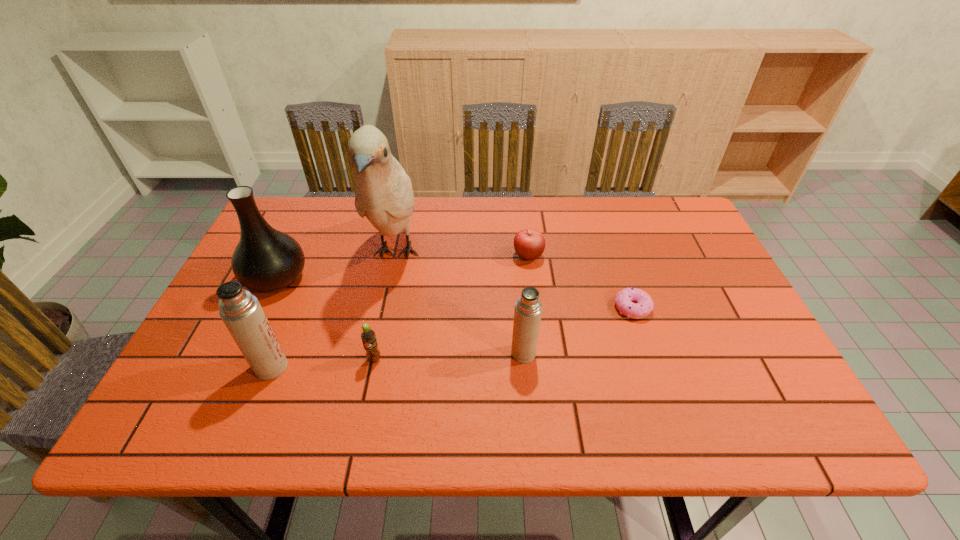
At what (x,y) coordinates should I click in order to perform the action: click on the taller thermos bottle. Please return your answer as a coordinate pair (x, y). The image size is (960, 540). Looking at the image, I should click on (241, 312).

Find the location of a particular element. the shorter thermos bottle is located at coordinates (528, 309).

You are a GUI agent. You are given a task and a screenshot of the screen. Output one action in this format:
    pyautogui.click(x=<x>, y=<y>)
    Task: Click on the right thermos bottle
    The height and width of the screenshot is (540, 960).
    Given the screenshot: What is the action you would take?
    pyautogui.click(x=528, y=309)

At what (x,y) coordinates should I click in order to perform the action: click on the tallest object. Please return your answer as a coordinate pair (x, y). This screenshot has width=960, height=540. Looking at the image, I should click on (383, 193).

I want to click on apple, so pyautogui.click(x=529, y=244).

This screenshot has width=960, height=540. I want to click on vase, so click(x=265, y=260).

Where is `the rightmost object`? Image resolution: width=960 pixels, height=540 pixels. the rightmost object is located at coordinates (643, 304).

You are a GUI agent. You are given a task and a screenshot of the screen. Output one action in this format:
    pyautogui.click(x=<x>, y=<y>)
    Task: Click on the doughnut
    Image resolution: width=960 pixels, height=540 pixels.
    Given the screenshot: What is the action you would take?
    pyautogui.click(x=643, y=304)

Find the location of a particular element. soda is located at coordinates (368, 336).

You are a GUI agent. You are given a task and a screenshot of the screen. Output one action in this format:
    pyautogui.click(x=<x>, y=<y>)
    Task: Click on the vacant space located on the right of the taller thermos bottle
    This screenshot has height=540, width=960.
    Given the screenshot: What is the action you would take?
    pyautogui.click(x=381, y=367)